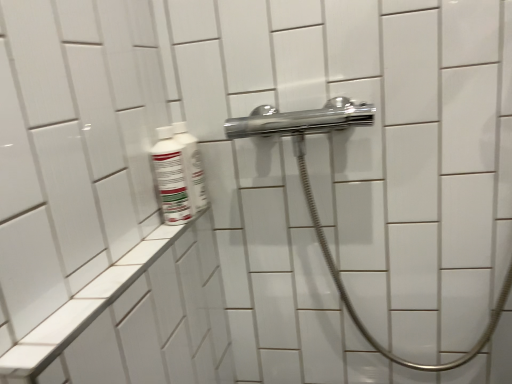
Question: Considering the relative sizes of white glossy bottle at left, the second mouthwash positioned from the back, and white glossy bottle at upper left, acting as the 1th mouthwash starting from the back, in the image provided, is white glossy bottle at left, the second mouthwash positioned from the back, shorter than white glossy bottle at upper left, acting as the 1th mouthwash starting from the back,?

Choices:
 (A) yes
 (B) no

Answer: (A)

Question: From the image's perspective, is white glossy bottle at left, placed as the first mouthwash when sorted from front to back, above white glossy bottle at upper left, acting as the 1th mouthwash starting from the back?

Choices:
 (A) no
 (B) yes

Answer: (A)

Question: Can you confirm if white glossy bottle at left, the second mouthwash positioned from the back, is smaller than white glossy bottle at upper left, acting as the 1th mouthwash starting from the back?

Choices:
 (A) no
 (B) yes

Answer: (A)

Question: Does white glossy bottle at left, placed as the first mouthwash when sorted from front to back, have a larger size compared to white glossy bottle at upper left, which is the 2th mouthwash in front-to-back order?

Choices:
 (A) no
 (B) yes

Answer: (B)

Question: From a real-world perspective, is white glossy bottle at left, placed as the first mouthwash when sorted from front to back, on top of white glossy bottle at upper left, which is the 2th mouthwash in front-to-back order?

Choices:
 (A) yes
 (B) no

Answer: (B)

Question: Is white glossy bottle at left, placed as the first mouthwash when sorted from front to back, bigger or smaller than white glossy bottle at upper left, acting as the 1th mouthwash starting from the back?

Choices:
 (A) big
 (B) small

Answer: (A)

Question: Visually, is white glossy bottle at left, the second mouthwash positioned from the back, positioned to the left or to the right of white glossy bottle at upper left, acting as the 1th mouthwash starting from the back?

Choices:
 (A) right
 (B) left

Answer: (B)

Question: From a real-world perspective, is white glossy bottle at left, placed as the first mouthwash when sorted from front to back, physically located above or below white glossy bottle at upper left, which is the 2th mouthwash in front-to-back order?

Choices:
 (A) above
 (B) below

Answer: (B)

Question: Does point (161, 195) appear closer or farther from the camera than point (202, 173)?

Choices:
 (A) farther
 (B) closer

Answer: (B)

Question: Looking at the image, does white glossy bottle at upper left, acting as the 1th mouthwash starting from the back, seem bigger or smaller compared to white ceramic ledge at lower left?

Choices:
 (A) small
 (B) big

Answer: (A)

Question: Considering the relative positions of white glossy bottle at upper left, which is the 2th mouthwash in front-to-back order, and white ceramic ledge at lower left in the image provided, is white glossy bottle at upper left, which is the 2th mouthwash in front-to-back order, to the left or to the right of white ceramic ledge at lower left?

Choices:
 (A) right
 (B) left

Answer: (A)

Question: Choose the correct answer: Is white glossy bottle at upper left, acting as the 1th mouthwash starting from the back, inside white ceramic ledge at lower left or outside it?

Choices:
 (A) inside
 (B) outside

Answer: (B)

Question: From a real-world perspective, relative to white ceramic ledge at lower left, is white glossy bottle at upper left, which is the 2th mouthwash in front-to-back order, vertically above or below?

Choices:
 (A) below
 (B) above

Answer: (B)

Question: Based on their sizes in the image, would you say white glossy bottle at upper left, acting as the 1th mouthwash starting from the back, is bigger or smaller than white glossy bottle at left, placed as the first mouthwash when sorted from front to back?

Choices:
 (A) big
 (B) small

Answer: (B)

Question: Choose the correct answer: Is white glossy bottle at upper left, acting as the 1th mouthwash starting from the back, inside white glossy bottle at left, placed as the first mouthwash when sorted from front to back, or outside it?

Choices:
 (A) outside
 (B) inside

Answer: (A)